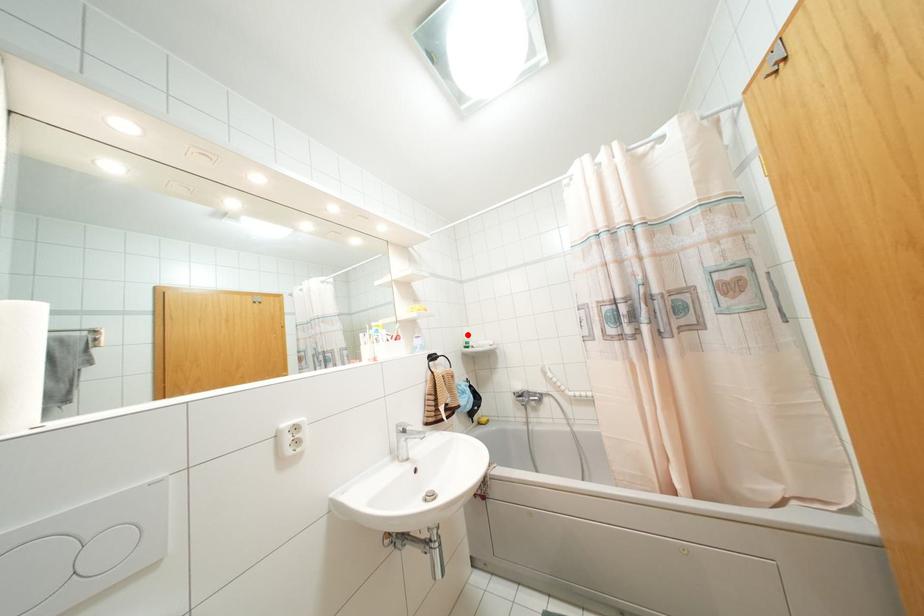
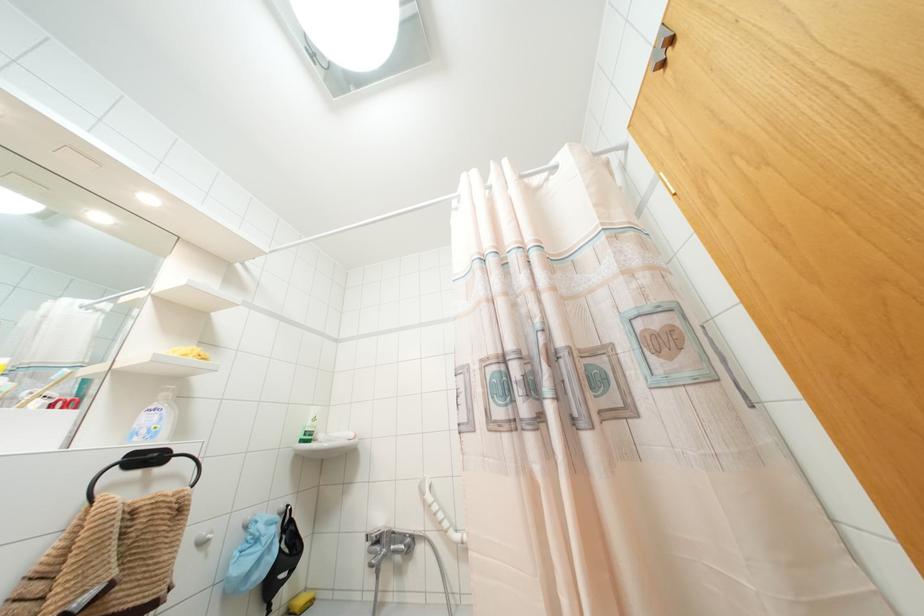
Find the pixel in the second image that matches the highlighted location in the first image.

(312, 419)